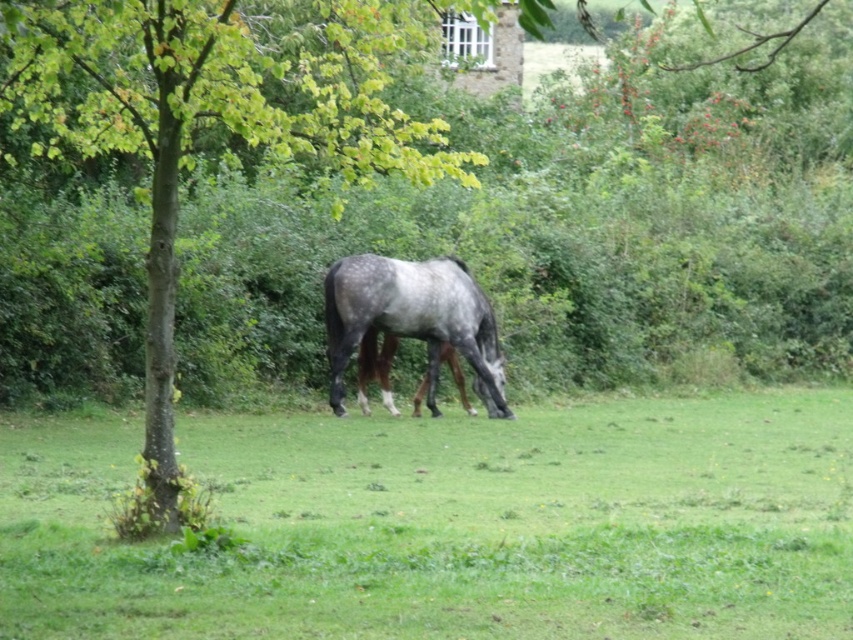
Question: Is green grass at center to the left of speckled gray horse at center from the viewer's perspective?

Choices:
 (A) no
 (B) yes

Answer: (B)

Question: Which point is closer to the camera?

Choices:
 (A) (428, 381)
 (B) (293, 72)
 (C) (788, 497)

Answer: (C)

Question: Which point is closer to the camera?

Choices:
 (A) speckled gray horse at center
 (B) green grass at center
 (C) green leafy tree at center

Answer: (B)

Question: Can you confirm if green leafy tree at center is smaller than speckled gray horse at center?

Choices:
 (A) no
 (B) yes

Answer: (A)

Question: Which point appears closest to the camera in this image?

Choices:
 (A) (61, 595)
 (B) (170, 376)
 (C) (419, 266)

Answer: (A)

Question: Does green grass at center have a larger size compared to speckled gray horse at center?

Choices:
 (A) no
 (B) yes

Answer: (B)